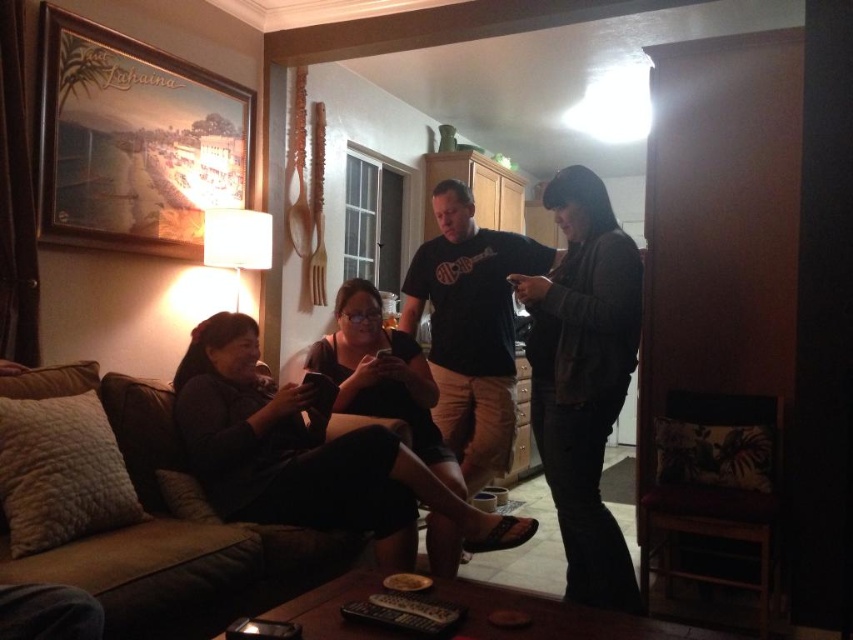
Looking at this image, you are standing at the entrance of the living room and want to sit down on the brown fabric couch at lower left. Which direction should you walk to reach it?

The brown fabric couch at lower left is located at point (167, 531), so you should walk towards the lower left direction to reach it.